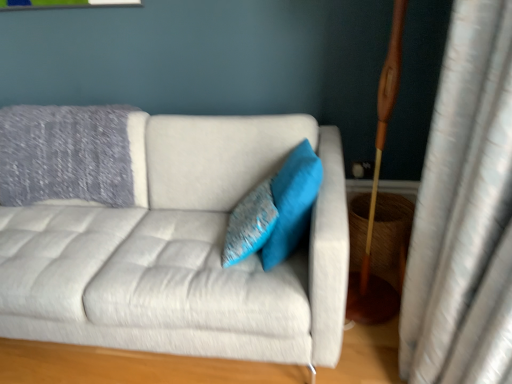
How much space does turquoise fabric pillow at center, the first pillow when ordered from right to left, occupy vertically?

turquoise fabric pillow at center, the first pillow when ordered from right to left, is 37.21 centimeters in height.

You are a GUI agent. You are given a task and a screenshot of the screen. Output one action in this format:
    pyautogui.click(x=<x>, y=<y>)
    Task: Click on the textured blue pillow at center, which ranks as the 2th pillow in right-to-left order
    This screenshot has width=512, height=384.
    Given the screenshot: What is the action you would take?
    pyautogui.click(x=250, y=224)

Locate an element on the screen. This screenshot has height=384, width=512. light gray fabric couch at center is located at coordinates (166, 237).

Is light gray fabric couch at center in contact with textured blue pillow at center, the 1th pillow when ordered from left to right?

No, light gray fabric couch at center is not in contact with textured blue pillow at center, the 1th pillow when ordered from left to right.

Between light gray fabric couch at center and textured blue pillow at center, which ranks as the 2th pillow in right-to-left order, which one appears on the left side from the viewer's perspective?

light gray fabric couch at center is more to the left.

From the image's perspective, does light gray fabric couch at center appear higher than textured blue pillow at center, which ranks as the 2th pillow in right-to-left order?

No, from the image's perspective, light gray fabric couch at center is not over textured blue pillow at center, which ranks as the 2th pillow in right-to-left order.

How much distance is there between light gray fabric couch at center and textured blue pillow at center, which ranks as the 2th pillow in right-to-left order?

A distance of 13.54 inches exists between light gray fabric couch at center and textured blue pillow at center, which ranks as the 2th pillow in right-to-left order.

At what (x,y) coordinates should I click in order to perform the action: click on studio couch that appears below the turquoise fabric pillow at center, which ranks as the 2th pillow in left-to-right order (from a real-world perspective). Please return your answer as a coordinate pair (x, y). The image size is (512, 384). Looking at the image, I should click on (166, 237).

Could you tell me if turquoise fabric pillow at center, the first pillow when ordered from right to left, is facing light gray fabric couch at center?

Yes, turquoise fabric pillow at center, the first pillow when ordered from right to left, is oriented towards light gray fabric couch at center.

Between turquoise fabric pillow at center, the first pillow when ordered from right to left, and light gray fabric couch at center, which one has larger width?

light gray fabric couch at center is wider.

Is light gray fabric couch at center touching turquoise fabric pillow at center, which ranks as the 2th pillow in left-to-right order?

No, light gray fabric couch at center is not next to turquoise fabric pillow at center, which ranks as the 2th pillow in left-to-right order.

Is point (254, 345) closer or farther from the camera than point (297, 205)?

Point (254, 345) is farther from the camera than point (297, 205).

Which is more to the right, light gray fabric couch at center or turquoise fabric pillow at center, the first pillow when ordered from right to left?

turquoise fabric pillow at center, the first pillow when ordered from right to left, is more to the right.

Is light gray fabric couch at center inside or outside of turquoise fabric pillow at center, which ranks as the 2th pillow in left-to-right order?

light gray fabric couch at center is not inside turquoise fabric pillow at center, which ranks as the 2th pillow in left-to-right order, it's outside.

Is textured blue pillow at center, the 1th pillow when ordered from left to right, positioned far away from light gray fabric couch at center?

That's not correct — textured blue pillow at center, the 1th pillow when ordered from left to right, is a little close to light gray fabric couch at center.

Looking at this image, is textured blue pillow at center, the 1th pillow when ordered from left to right, not within light gray fabric couch at center?

No, textured blue pillow at center, the 1th pillow when ordered from left to right, is not entirely external to light gray fabric couch at center.

Considering the sizes of objects textured blue pillow at center, which ranks as the 2th pillow in right-to-left order, and light gray fabric couch at center in the image provided, who is thinner, textured blue pillow at center, which ranks as the 2th pillow in right-to-left order, or light gray fabric couch at center?

Thinner between the two is textured blue pillow at center, which ranks as the 2th pillow in right-to-left order.

Is textured blue pillow at center, the 1th pillow when ordered from left to right, taller than turquoise fabric pillow at center, the first pillow when ordered from right to left?

In fact, textured blue pillow at center, the 1th pillow when ordered from left to right, may be shorter than turquoise fabric pillow at center, the first pillow when ordered from right to left.

Does textured blue pillow at center, which ranks as the 2th pillow in right-to-left order, come in front of turquoise fabric pillow at center, which ranks as the 2th pillow in left-to-right order?

That is False.

Is point (252, 213) positioned before point (315, 161)?

No, it is behind (315, 161).

Considering the sizes of objects turquoise fabric pillow at center, which ranks as the 2th pillow in left-to-right order, and textured blue pillow at center, the 1th pillow when ordered from left to right, in the image provided, who is bigger, turquoise fabric pillow at center, which ranks as the 2th pillow in left-to-right order, or textured blue pillow at center, the 1th pillow when ordered from left to right,?

Bigger between the two is turquoise fabric pillow at center, which ranks as the 2th pillow in left-to-right order.

From the image's perspective, is turquoise fabric pillow at center, which ranks as the 2th pillow in left-to-right order, above or below textured blue pillow at center, which ranks as the 2th pillow in right-to-left order?

Based on their image positions, turquoise fabric pillow at center, which ranks as the 2th pillow in left-to-right order, is located above textured blue pillow at center, which ranks as the 2th pillow in right-to-left order.

Between turquoise fabric pillow at center, the first pillow when ordered from right to left, and textured blue pillow at center, the 1th pillow when ordered from left to right, which one has less height?

With less height is textured blue pillow at center, the 1th pillow when ordered from left to right.

There is a light gray fabric couch at center. Identify the location of the 1st pillow above it (from the image's perspective). This screenshot has height=384, width=512. 250,224.

You are a GUI agent. You are given a task and a screenshot of the screen. Output one action in this format:
    pyautogui.click(x=<x>, y=<y>)
    Task: Click on the 2nd pillow to the right of the light gray fabric couch at center, counting from the anchor's position
    Image resolution: width=512 pixels, height=384 pixels.
    Given the screenshot: What is the action you would take?
    pyautogui.click(x=292, y=203)

Based on their spatial positions, is textured blue pillow at center, which ranks as the 2th pillow in right-to-left order, or turquoise fabric pillow at center, the first pillow when ordered from right to left, further from light gray fabric couch at center?

Among the two, turquoise fabric pillow at center, the first pillow when ordered from right to left, is located further to light gray fabric couch at center.

Based on their spatial positions, is light gray fabric couch at center or textured blue pillow at center, the 1th pillow when ordered from left to right, further from turquoise fabric pillow at center, the first pillow when ordered from right to left?

light gray fabric couch at center lies further to turquoise fabric pillow at center, the first pillow when ordered from right to left, than the other object.

From the image, which object appears to be farther from textured blue pillow at center, the 1th pillow when ordered from left to right, light gray fabric couch at center or turquoise fabric pillow at center, the first pillow when ordered from right to left?

light gray fabric couch at center is positioned further to the anchor textured blue pillow at center, the 1th pillow when ordered from left to right.

Which object lies further to the anchor point textured blue pillow at center, which ranks as the 2th pillow in right-to-left order, turquoise fabric pillow at center, which ranks as the 2th pillow in left-to-right order, or light gray fabric couch at center?

Based on the image, light gray fabric couch at center appears to be further to textured blue pillow at center, which ranks as the 2th pillow in right-to-left order.

Estimate the real-world distances between objects in this image. Which object is closer to turquoise fabric pillow at center, which ranks as the 2th pillow in left-to-right order, textured blue pillow at center, the 1th pillow when ordered from left to right, or light gray fabric couch at center?

textured blue pillow at center, the 1th pillow when ordered from left to right, lies closer to turquoise fabric pillow at center, which ranks as the 2th pillow in left-to-right order, than the other object.

Considering their positions, is turquoise fabric pillow at center, which ranks as the 2th pillow in left-to-right order, positioned closer to light gray fabric couch at center than textured blue pillow at center, which ranks as the 2th pillow in right-to-left order?

textured blue pillow at center, which ranks as the 2th pillow in right-to-left order, lies closer to light gray fabric couch at center than the other object.

What are the coordinates of `pillow situated between light gray fabric couch at center and turquoise fabric pillow at center, the first pillow when ordered from right to left, from left to right` in the screenshot? It's located at (250, 224).